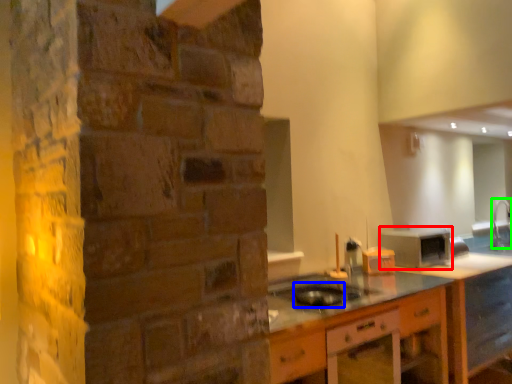
Question: Considering the real-world distances, which object is farthest from appliance (highlighted by a red box)? appliance (highlighted by a blue box) or faucet (highlighted by a green box)?

Choices:
 (A) appliance
 (B) faucet

Answer: (B)